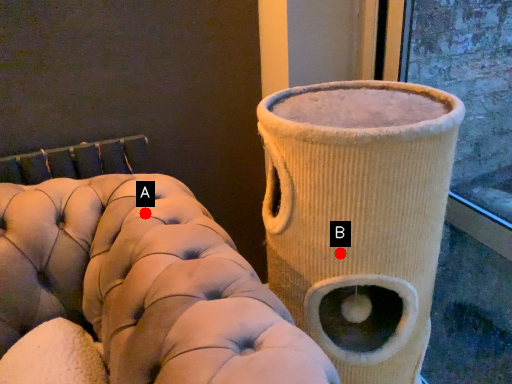
Question: Two points are circled on the image, labeled by A and B beside each circle. Which point is farther to the camera?

Choices:
 (A) A is further
 (B) B is further

Answer: (A)